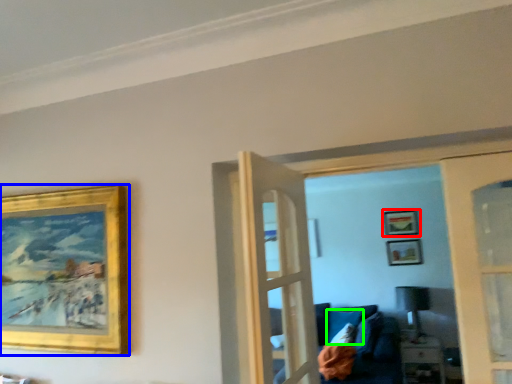
Question: Considering the real-world distances, which object is farthest from picture frame (highlighted by a red box)? picture frame (highlighted by a blue box) or pillow (highlighted by a green box)?

Choices:
 (A) picture frame
 (B) pillow

Answer: (A)